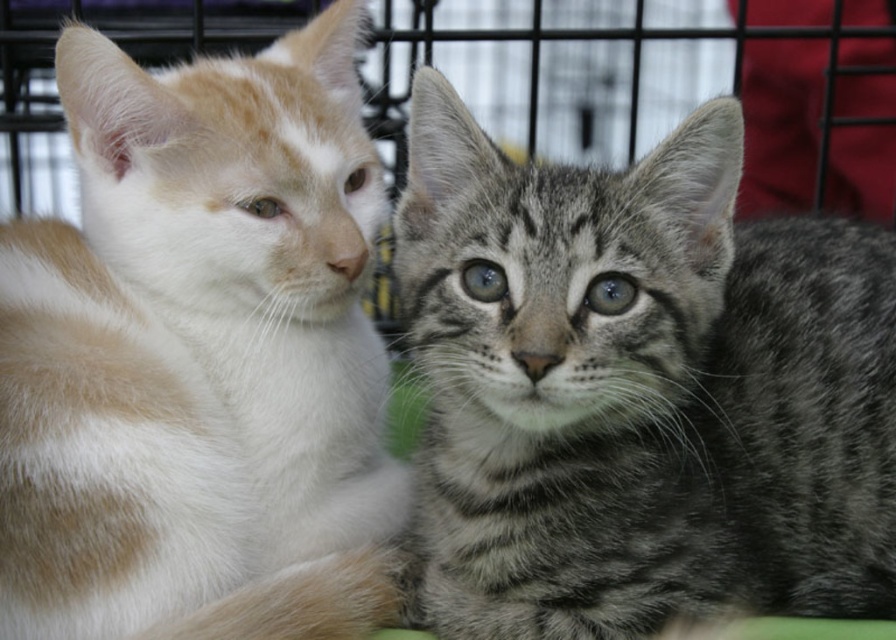
Question: Is gray striped kitten at center positioned in front of white fur cat at left?

Choices:
 (A) yes
 (B) no

Answer: (B)

Question: Does gray striped kitten at center have a greater width compared to white fur cat at left?

Choices:
 (A) yes
 (B) no

Answer: (A)

Question: Which point appears closest to the camera in this image?

Choices:
 (A) (29, 609)
 (B) (543, 241)

Answer: (A)

Question: Among these objects, which one is farthest from the camera?

Choices:
 (A) white fur cat at left
 (B) gray striped kitten at center

Answer: (B)

Question: Does gray striped kitten at center have a lesser width compared to white fur cat at left?

Choices:
 (A) no
 (B) yes

Answer: (A)

Question: Which of the following is the closest to the observer?

Choices:
 (A) (785, 237)
 (B) (53, 268)

Answer: (B)